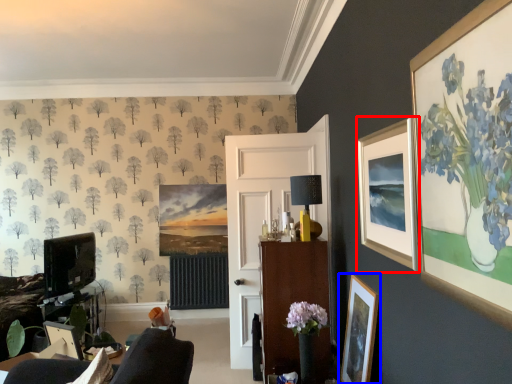
Question: Which object appears closest to the camera in this image, picture frame (highlighted by a red box) or picture frame (highlighted by a blue box)?

Choices:
 (A) picture frame
 (B) picture frame

Answer: (A)